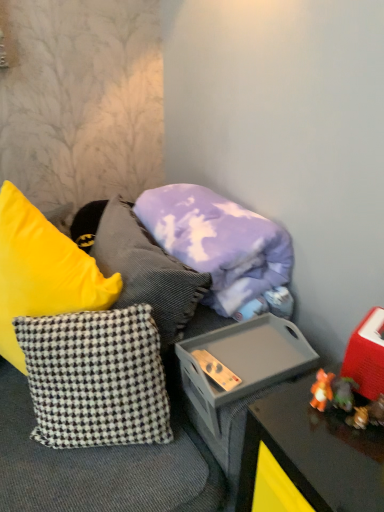
Question: From the image's perspective, is purple cotton pillow at center, the first pillow positioned from the top, beneath black and white checkered pillow at center, the 2th pillow positioned from the top?

Choices:
 (A) yes
 (B) no

Answer: (B)

Question: Considering the relative sizes of purple cotton pillow at center, the first pillow positioned from the top, and black and white checkered pillow at center, the first pillow positioned from the bottom, in the image provided, is purple cotton pillow at center, the first pillow positioned from the top, thinner than black and white checkered pillow at center, the first pillow positioned from the bottom,?

Choices:
 (A) yes
 (B) no

Answer: (B)

Question: Does purple cotton pillow at center, which ranks as the second pillow in bottom-to-top order, lie behind black and white checkered pillow at center, the first pillow positioned from the bottom?

Choices:
 (A) no
 (B) yes

Answer: (B)

Question: From a real-world perspective, is purple cotton pillow at center, which ranks as the second pillow in bottom-to-top order, beneath black and white checkered pillow at center, the first pillow positioned from the bottom?

Choices:
 (A) no
 (B) yes

Answer: (A)

Question: Considering the relative sizes of purple cotton pillow at center, which ranks as the second pillow in bottom-to-top order, and black and white checkered pillow at center, the 2th pillow positioned from the top, in the image provided, is purple cotton pillow at center, which ranks as the second pillow in bottom-to-top order, shorter than black and white checkered pillow at center, the 2th pillow positioned from the top,?

Choices:
 (A) yes
 (B) no

Answer: (A)

Question: Does purple cotton pillow at center, the first pillow positioned from the top, appear on the left side of black and white checkered pillow at center, the 2th pillow positioned from the top?

Choices:
 (A) yes
 (B) no

Answer: (B)

Question: Is purple cotton pillow at center, which ranks as the second pillow in bottom-to-top order, located within black and white checkered pillow at center, the first pillow positioned from the bottom?

Choices:
 (A) yes
 (B) no

Answer: (B)

Question: Is black and white checkered pillow at center, the first pillow positioned from the bottom, completely or partially outside of purple cotton pillow at center, which ranks as the second pillow in bottom-to-top order?

Choices:
 (A) no
 (B) yes

Answer: (B)

Question: From a real-world perspective, is black and white checkered pillow at center, the first pillow positioned from the bottom, physically above purple cotton pillow at center, which ranks as the second pillow in bottom-to-top order?

Choices:
 (A) no
 (B) yes

Answer: (A)

Question: Does black and white checkered pillow at center, the first pillow positioned from the bottom, have a larger size compared to purple cotton pillow at center, which ranks as the second pillow in bottom-to-top order?

Choices:
 (A) yes
 (B) no

Answer: (B)

Question: Is black and white checkered pillow at center, the first pillow positioned from the bottom, looking in the opposite direction of purple cotton pillow at center, which ranks as the second pillow in bottom-to-top order?

Choices:
 (A) no
 (B) yes

Answer: (B)

Question: Does black and white checkered pillow at center, the 2th pillow positioned from the top, appear on the right side of purple cotton pillow at center, the first pillow positioned from the top?

Choices:
 (A) no
 (B) yes

Answer: (A)

Question: In terms of size, does purple cotton pillow at center, which ranks as the second pillow in bottom-to-top order, appear bigger or smaller than black and white checkered pillow at center, the 2th pillow positioned from the top?

Choices:
 (A) small
 (B) big

Answer: (B)